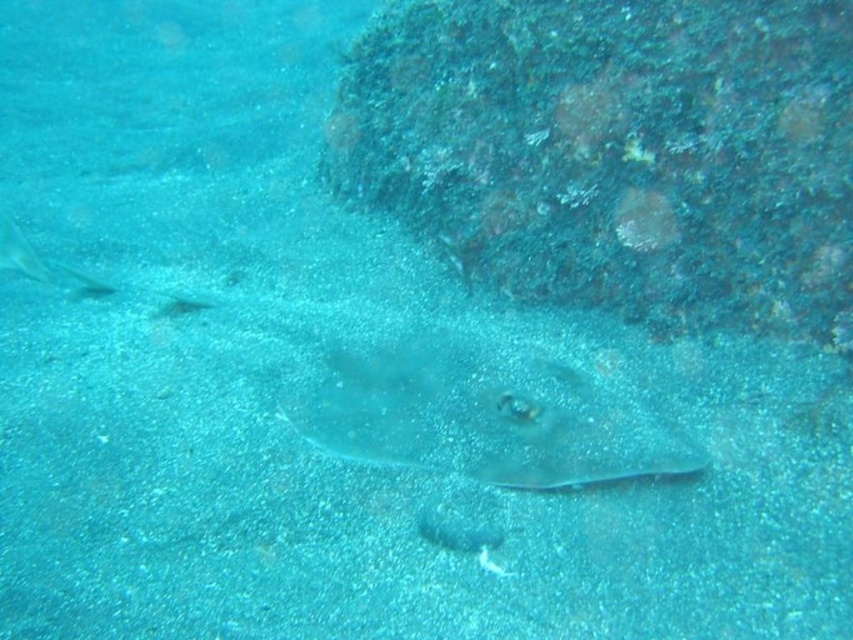
You are a scuba diver looking for a hidden treasure chest. You see a rough textured rock at upper right and a translucent rubber stingray at center. Which object is positioned higher in the water column?

The rough textured rock at upper right is located above the translucent rubber stingray at center, so it is positioned higher in the water column.